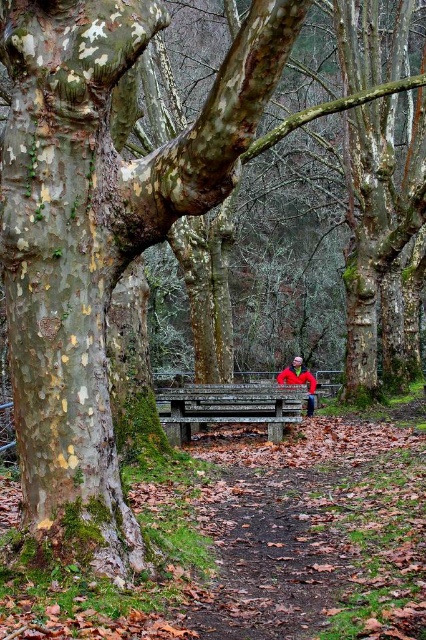
Who is more distant from viewer, (x=264, y=387) or (x=285, y=381)?

Point (x=285, y=381)

Describe the element at coordinates (227, 406) in the screenshot. I see `wooden bench at center` at that location.

I want to click on wooden bench at center, so click(227, 406).